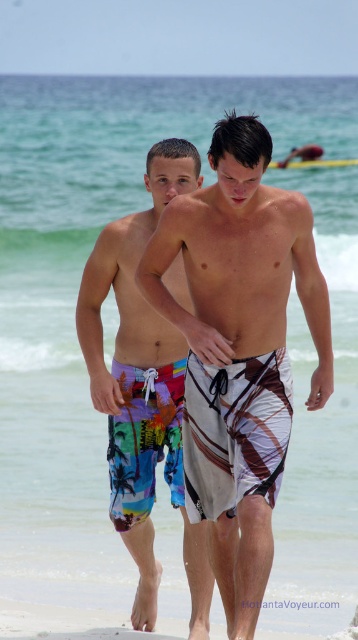
The width and height of the screenshot is (358, 640). What do you see at coordinates (143, 388) in the screenshot?
I see `multicolored printed boardshorts at left` at bounding box center [143, 388].

Which is in front, point (206, 588) or point (112, 627)?

Point (206, 588) is more forward.

This screenshot has width=358, height=640. What are the coordinates of `multicolored printed boardshorts at left` in the screenshot? It's located at (143, 388).